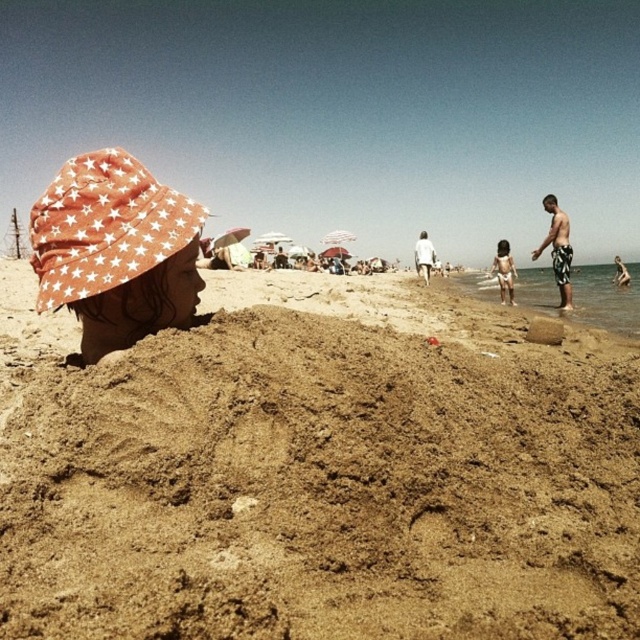
From the picture: Which is more to the right, brown sandy mound at lower center or black and white striped shorts at right?

From the viewer's perspective, black and white striped shorts at right appears more on the right side.

Does point (138, 436) lie in front of point (564, 284)?

Yes.

This screenshot has width=640, height=640. I want to click on brown sandy mound at lower center, so click(321, 490).

Does white skin child at lower center have a lesser width compared to light gray fabric shorts at center?

Incorrect, white skin child at lower center's width is not less than light gray fabric shorts at center's.

What do you see at coordinates (504, 269) in the screenshot? Image resolution: width=640 pixels, height=640 pixels. I see `white skin child at lower center` at bounding box center [504, 269].

At what (x,y) coordinates should I click in order to perform the action: click on white skin child at lower center. Please return your answer as a coordinate pair (x, y). Looking at the image, I should click on (504, 269).

Does black and white striped shorts at right appear under light gray fabric shorts at center?

Indeed, black and white striped shorts at right is positioned under light gray fabric shorts at center.

Does point (547, 244) come in front of point (420, 275)?

Yes.

Identify the location of black and white striped shorts at right. (x=557, y=250).